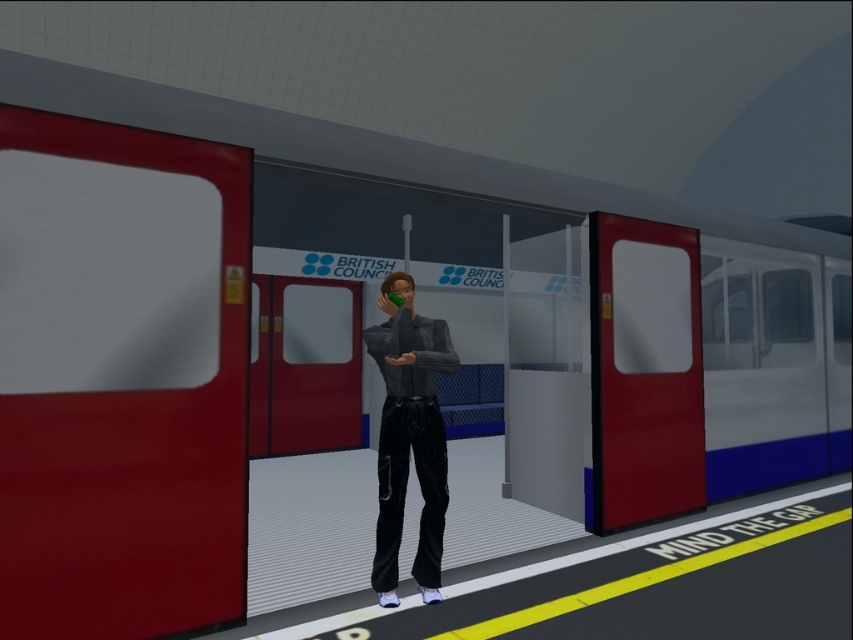
Does matte red door at right lie behind shiny black pants at center?

Yes.

Does matte red door at right appear on the left side of shiny black pants at center?

No, matte red door at right is not to the left of shiny black pants at center.

Find the location of a particular element. matte red door at right is located at coordinates (643, 371).